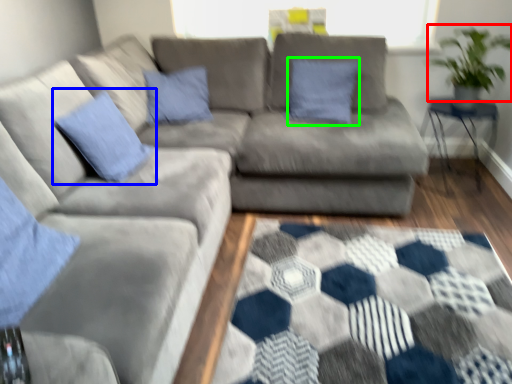
Question: Which is farther away from plant (highlighted by a red box)? pillow (highlighted by a blue box) or pillow (highlighted by a green box)?

Choices:
 (A) pillow
 (B) pillow

Answer: (A)